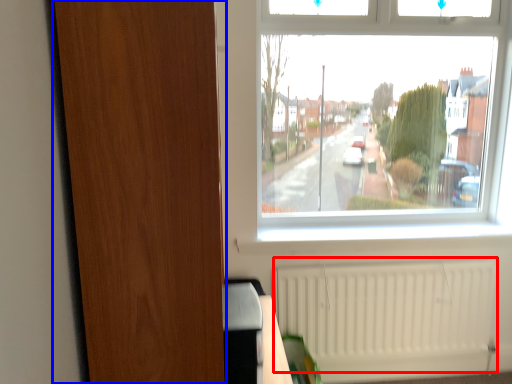
Question: Which point is further to the camera, radiator (highlighted by a red box) or screen door (highlighted by a blue box)?

Choices:
 (A) radiator
 (B) screen door

Answer: (A)